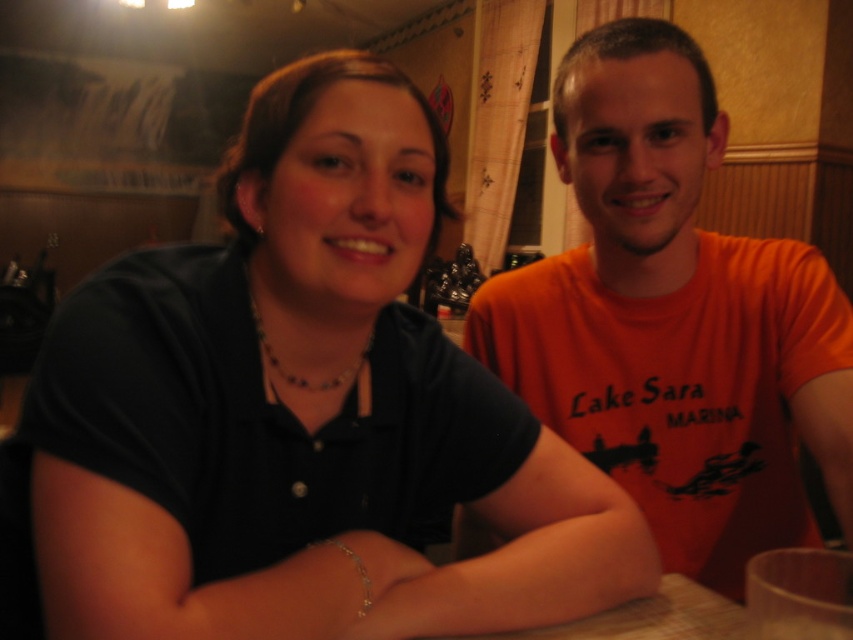
Question: Can you confirm if black matte shirt at center is wider than orange cotton t-shirt at center?

Choices:
 (A) yes
 (B) no

Answer: (A)

Question: Which object is closer to the camera taking this photo?

Choices:
 (A) black matte shirt at center
 (B) orange cotton t-shirt at center

Answer: (A)

Question: Is black matte shirt at center below orange cotton t-shirt at center?

Choices:
 (A) yes
 (B) no

Answer: (A)

Question: Is black matte shirt at center thinner than orange cotton t-shirt at center?

Choices:
 (A) yes
 (B) no

Answer: (B)

Question: Which of the following is the closest to the observer?

Choices:
 (A) (606, 452)
 (B) (271, 284)

Answer: (B)